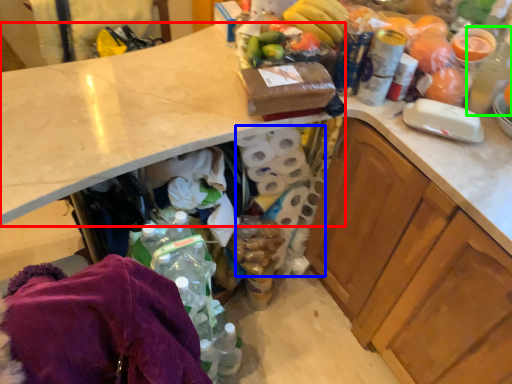
Question: Based on their relative distances, which object is nearer to countertop (highlighted by a red box)? Choose from toilet paper (highlighted by a blue box) and bottle (highlighted by a green box).

Choices:
 (A) toilet paper
 (B) bottle

Answer: (A)